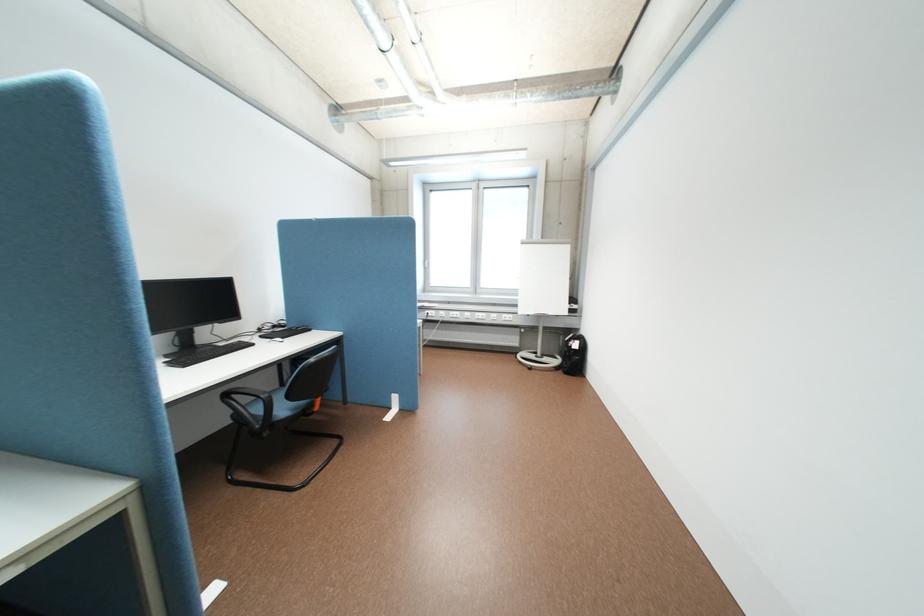
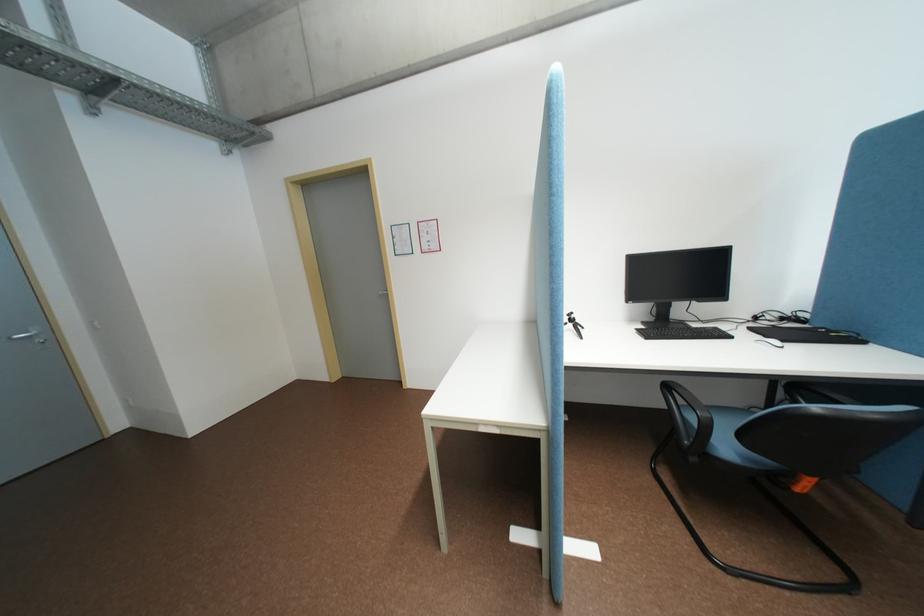
Find the pixel in the second image that matches (x=326, y=408) in the first image.

(808, 488)